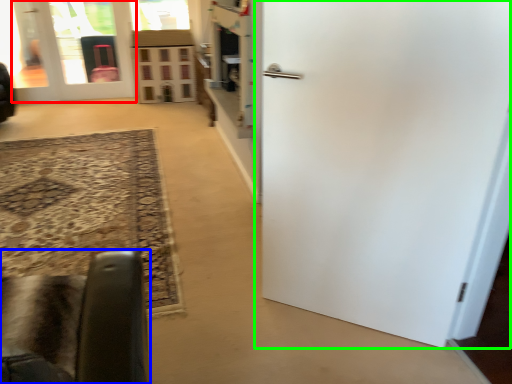
Question: Which object is positioned farthest from door (highlighted by a red box)? Select from furniture (highlighted by a blue box) and door (highlighted by a green box).

Choices:
 (A) furniture
 (B) door

Answer: (A)